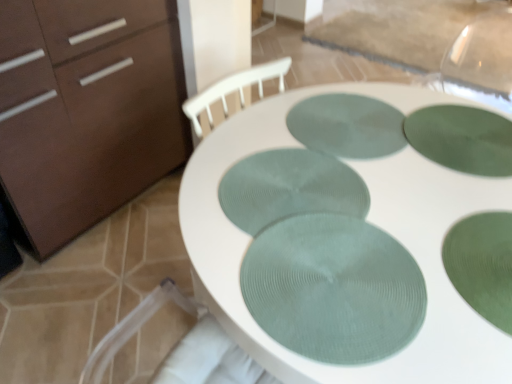
Where is `free location in front of green textured glass plate at center, the third glass plate when ordered from front to back`? free location in front of green textured glass plate at center, the third glass plate when ordered from front to back is located at coordinates (327, 297).